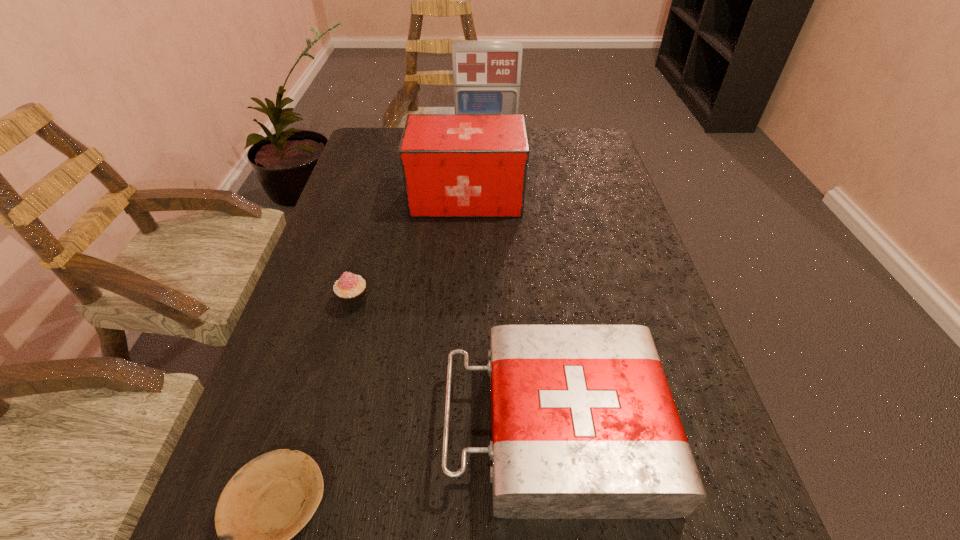
Where is `vacant space in between the shortest first-aid kit and the farthest first-aid kit`? Image resolution: width=960 pixels, height=540 pixels. vacant space in between the shortest first-aid kit and the farthest first-aid kit is located at coordinates (520, 287).

Locate an element on the screen. empty space between the farthest object and the cupcake is located at coordinates (420, 224).

Image resolution: width=960 pixels, height=540 pixels. Identify the location of the third closest object to the farthest first-aid kit. (584, 426).

Select which object appears as the fourth closest to the second farthest object. Please provide its 2D coordinates. Your answer should be formatted as a tuple, i.e. [(x, y)], where the tuple contains the x and y coordinates of a point satisfying the conditions above.

[(270, 499)]

Locate which first-aid kit is the second closest to the second nearest first-aid kit. Please provide its 2D coordinates. Your answer should be formatted as a tuple, i.e. [(x, y)], where the tuple contains the x and y coordinates of a point satisfying the conditions above.

[(584, 426)]

The width and height of the screenshot is (960, 540). Identify the location of the second closest first-aid kit to the farthest first-aid kit. (584, 426).

Image resolution: width=960 pixels, height=540 pixels. Find the location of `free space that satisfies the following two spatial constraints: 1. on the handle side of the second farthest object; 2. on the front side of the cupcake`. free space that satisfies the following two spatial constraints: 1. on the handle side of the second farthest object; 2. on the front side of the cupcake is located at coordinates pos(463,302).

You are a GUI agent. You are given a task and a screenshot of the screen. Output one action in this format:
    pyautogui.click(x=<x>, y=<y>)
    Task: Click on the vacant region that satisfies the following two spatial constraints: 1. on the front-facing side of the farthest first-aid kit; 2. on the handle side of the second tallest first-aid kit
    This screenshot has width=960, height=540.
    Given the screenshot: What is the action you would take?
    pyautogui.click(x=487, y=197)